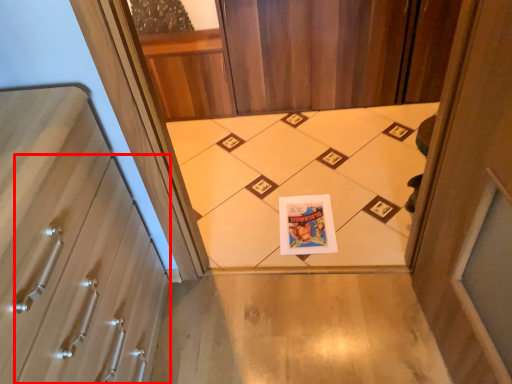
Question: In this image, where is drawer (annotated by the red box) located relative to print?

Choices:
 (A) left
 (B) right

Answer: (A)